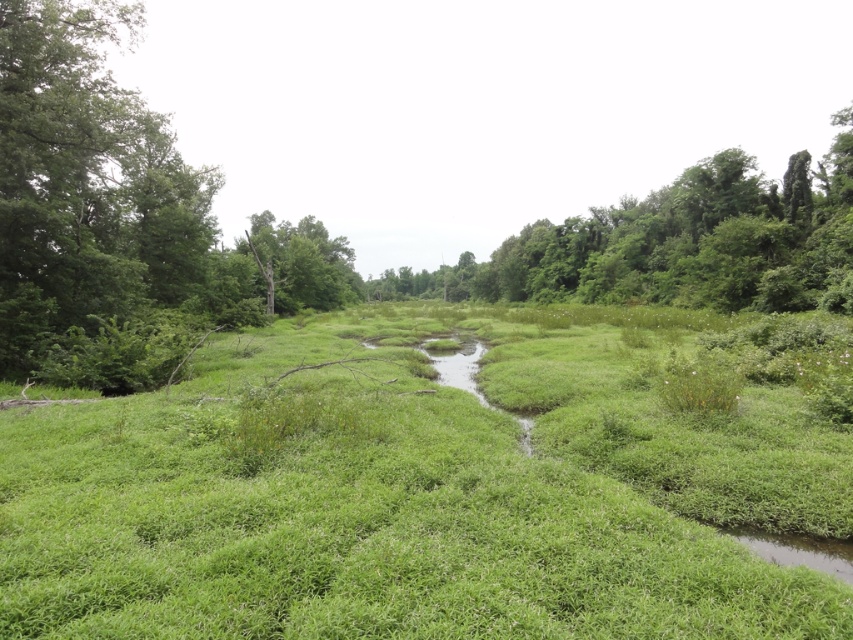
Is the position of green leafy tree at upper right less distant than that of brown rough tree trunk at center?

That is True.

Is point (444, 291) positioned in front of point (271, 241)?

No, it is not.

Find the location of a particular element. The height and width of the screenshot is (640, 853). green leafy tree at upper right is located at coordinates (679, 243).

Does green grassy at center have a larger size compared to green leafy tree at upper right?

Actually, green grassy at center might be smaller than green leafy tree at upper right.

Does green grassy at center have a greater height compared to green leafy tree at upper right?

Incorrect, green grassy at center's height is not larger of green leafy tree at upper right's.

The height and width of the screenshot is (640, 853). What are the coordinates of `green grassy at center` in the screenshot? It's located at (424, 490).

Based on the photo, who is more distant from viewer, (746, 396) or (339, 268)?

Point (339, 268)

From the picture: Is green grassy at center above brown rough tree trunk at center?

Incorrect, green grassy at center is not positioned above brown rough tree trunk at center.

Locate an element on the screen. The height and width of the screenshot is (640, 853). green grassy at center is located at coordinates (424, 490).